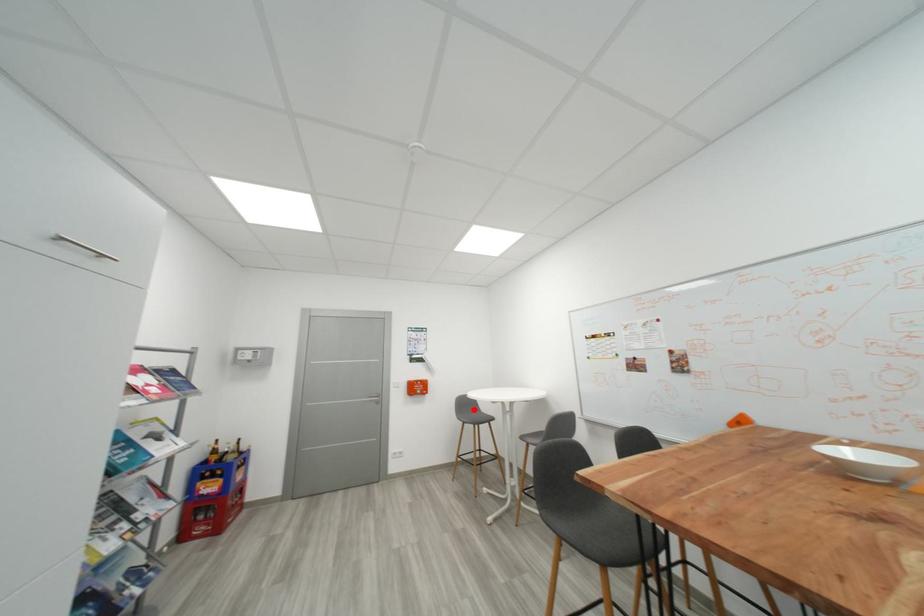
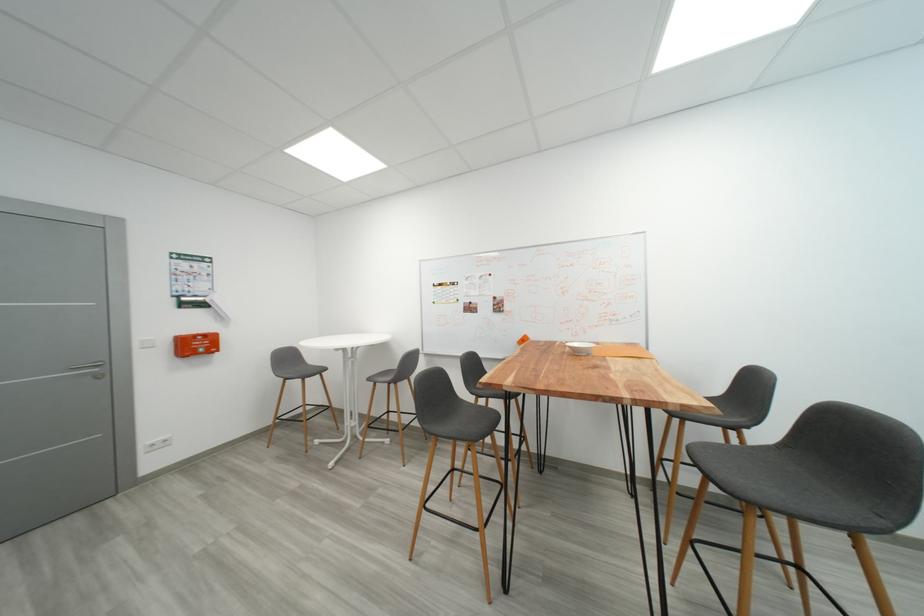
The point at the highlighted location is marked in the first image. Where is the corresponding point in the second image?

(295, 363)